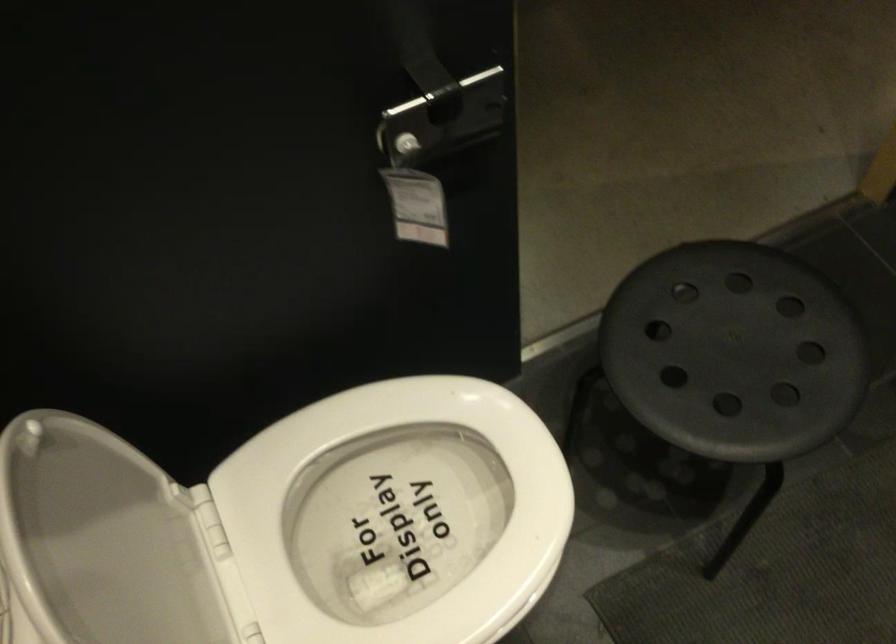
Describe the element at coordinates (444, 91) in the screenshot. I see `the door latch handle` at that location.